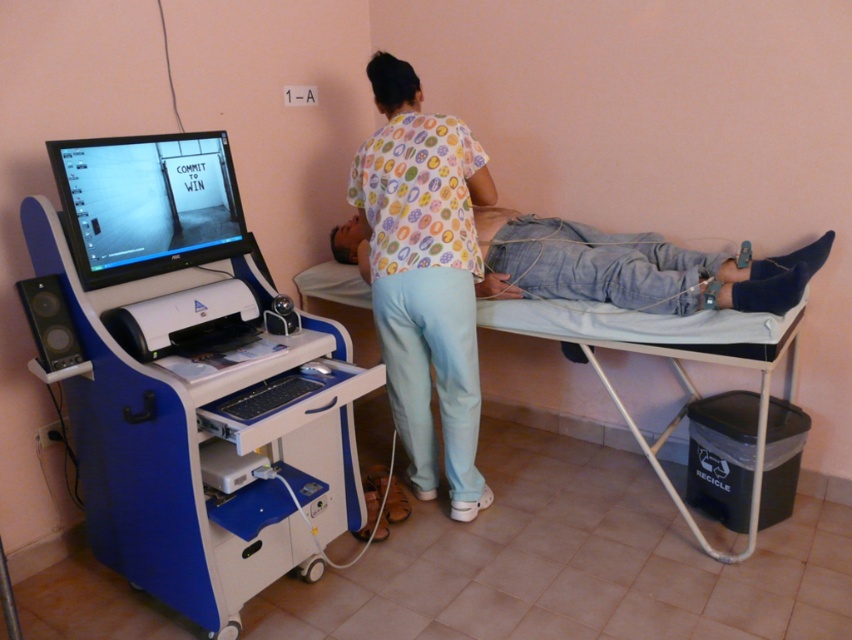
You are a healthcare worker standing at the foot of the bed in the medical scene. You need to retrieve a medical chart from the blue plastic cart at left. Can you reach it without moving from your current position?

The blue plastic cart at left is 1.74 meters away from the viewer. Since the average arm reach is about 1.5 meters, you would need to move closer to reach it.

You are a medical student observing the scene. You need to locate the printed fabric shirt at center for a case study. Where exactly is it positioned in the image?

The printed fabric shirt at center is positioned at the 2D coordinates point [424,275] in the image.